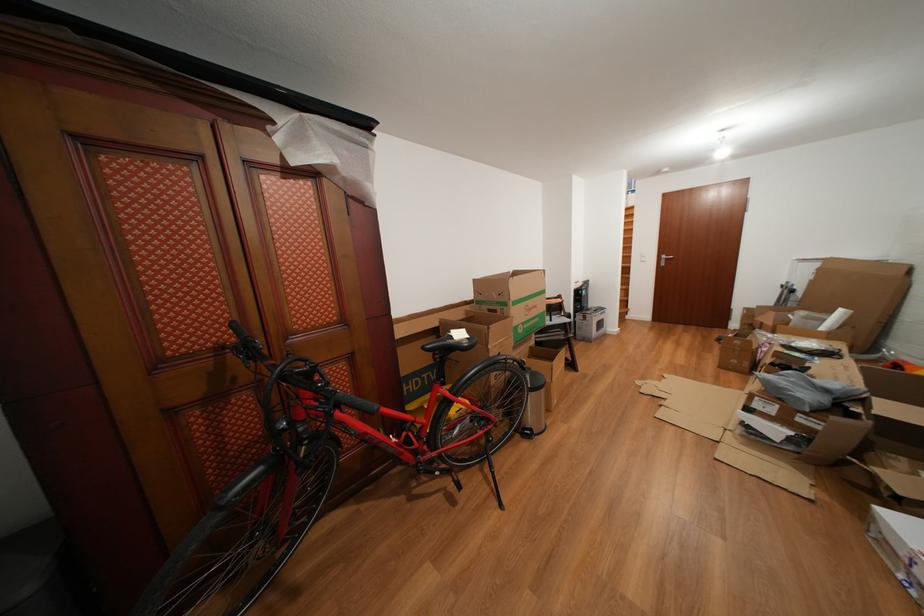
Image resolution: width=924 pixels, height=616 pixels. What do you see at coordinates (664, 259) in the screenshot? I see `the silver door handle` at bounding box center [664, 259].